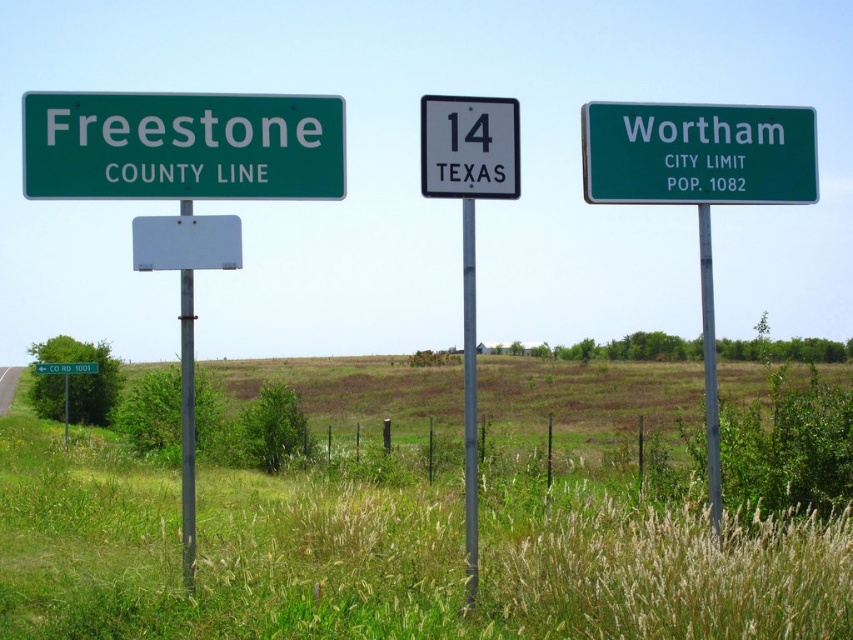
Question: From the image, what is the correct spatial relationship of metallic pole at center in relation to metallic gray pole at right?

Choices:
 (A) above
 (B) below

Answer: (B)

Question: Estimate the real-world distances between objects in this image. Which object is farther from the metallic pole at center?

Choices:
 (A) metallic gray pole at left
 (B) green matte freestone county line at left
 (C) green plastic sign at center

Answer: (C)

Question: Considering the relative positions of metallic gray sign at center and metallic gray pole at left in the image provided, where is metallic gray sign at center located with respect to metallic gray pole at left?

Choices:
 (A) below
 (B) above

Answer: (B)

Question: Does metallic gray sign at center have a smaller size compared to metallic pole at center?

Choices:
 (A) yes
 (B) no

Answer: (A)

Question: Which object is farther from the camera taking this photo?

Choices:
 (A) metallic pole at center
 (B) metallic gray pole at left
 (C) green matte freestone county line at left

Answer: (A)

Question: Which point appears closest to the camera in this image?

Choices:
 (A) (62, 369)
 (B) (492, 186)
 (C) (262, 156)
 (D) (463, 481)

Answer: (C)